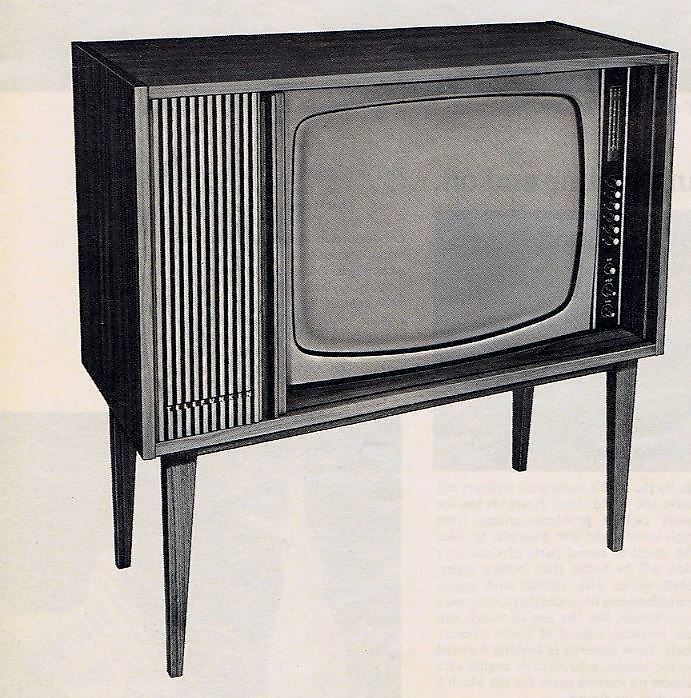
You are a GUI agent. You are given a task and a screenshot of the screen. Output one action in this format:
    pyautogui.click(x=<x>, y=<y>)
    Task: Click on the leg
    
    Given the screenshot: What is the action you would take?
    pyautogui.click(x=189, y=588), pyautogui.click(x=112, y=534), pyautogui.click(x=519, y=445), pyautogui.click(x=634, y=510)